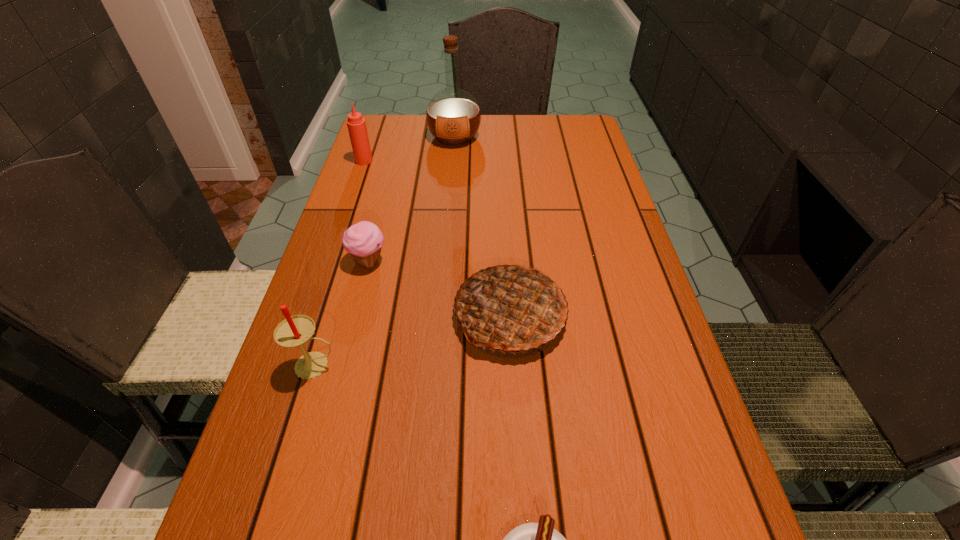
Identify which object is the third closest to the tallest object. Please provide its 2D coordinates. Your answer should be formatted as a tuple, i.e. [(x, y)], where the tuple contains the x and y coordinates of a point satisfying the conditions above.

[(511, 308)]

Find the location of a particular element. object that stands as the second closest to the fifth tallest object is located at coordinates (294, 331).